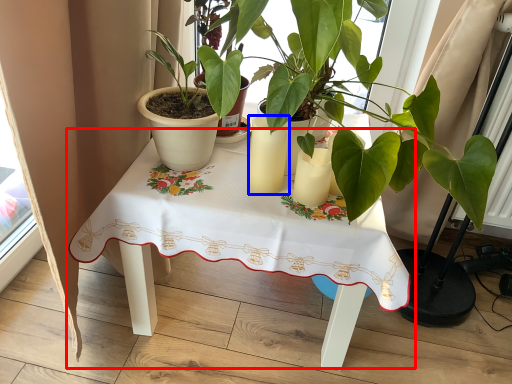
Question: Which object is further to the camera taking this photo, table (highlighted by a red box) or candle holder (highlighted by a blue box)?

Choices:
 (A) table
 (B) candle holder

Answer: (B)